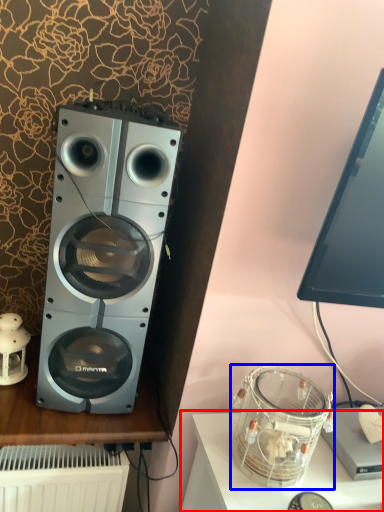
Question: Which point is closer to the camera, furniture (highlighted by a red box) or appliance (highlighted by a blue box)?

Choices:
 (A) furniture
 (B) appliance

Answer: (A)